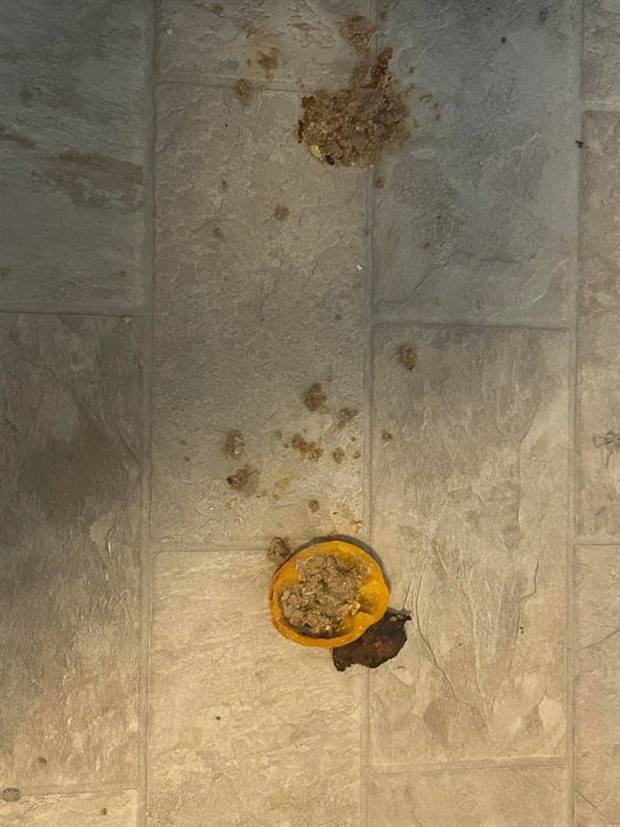
The height and width of the screenshot is (827, 620). Identify the location of dirty food on the floor. (382, 135).